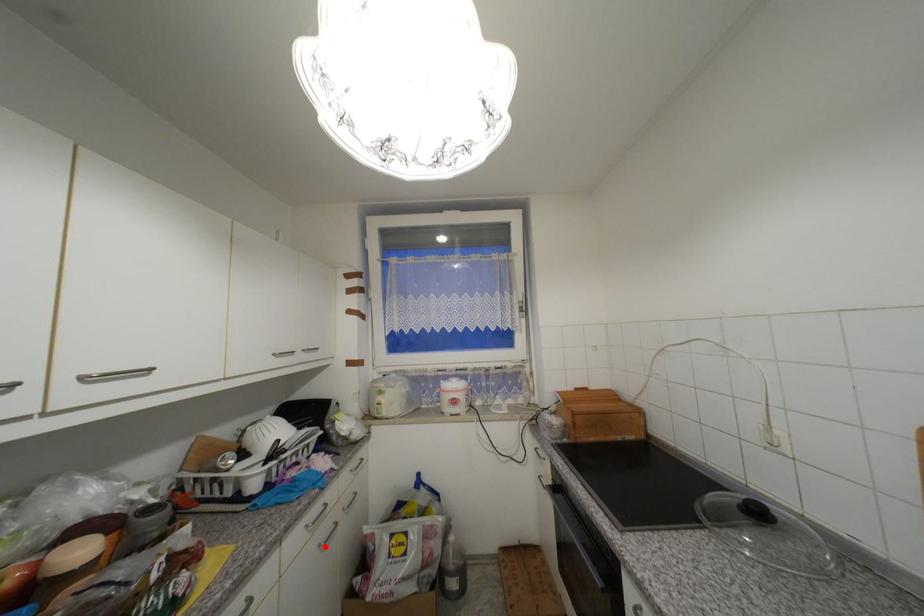
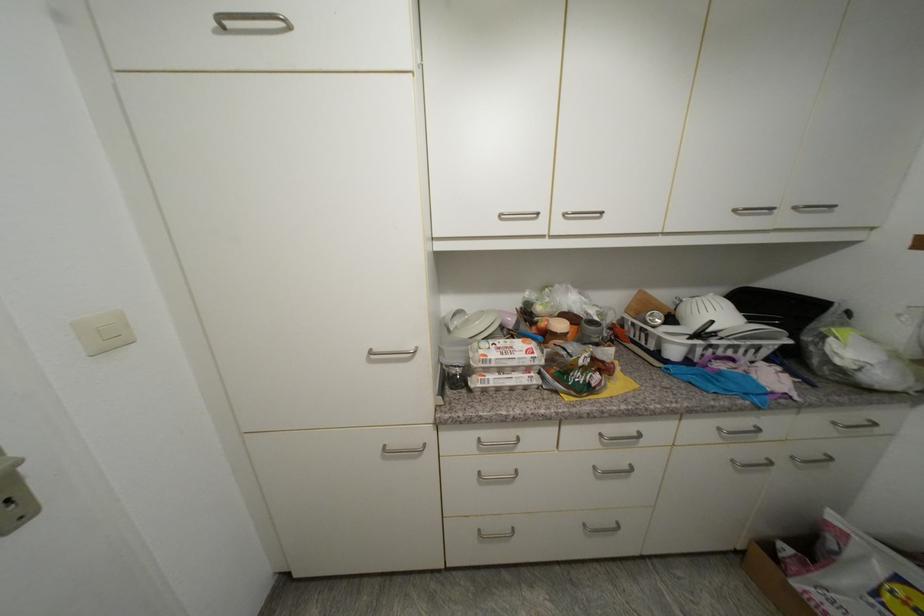
Where in the second image is the point corresponding to the highlighted location from the first image?

(738, 463)